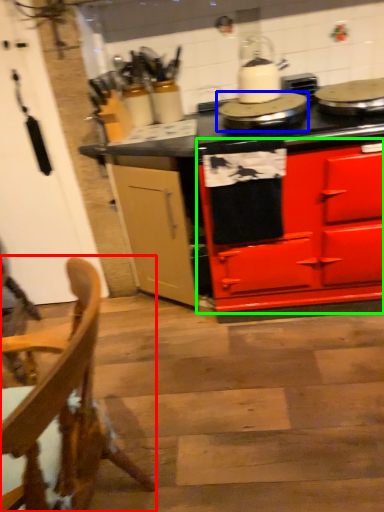
Question: Estimate the real-world distances between objects in this image. Which object is closer to chair (highlighted by a red box), appliance (highlighted by a blue box) or cabinetry (highlighted by a green box)?

Choices:
 (A) appliance
 (B) cabinetry

Answer: (B)